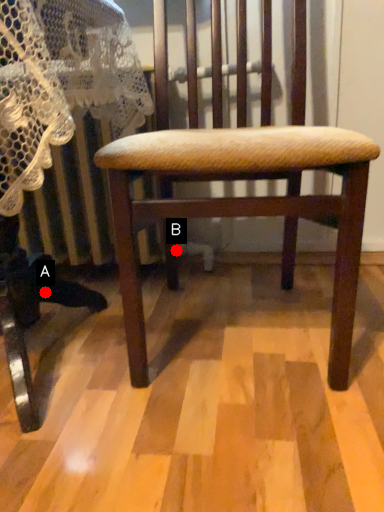
Question: Two points are circled on the image, labeled by A and B beside each circle. Which point is farther from the camera taking this photo?

Choices:
 (A) A is further
 (B) B is further

Answer: (B)